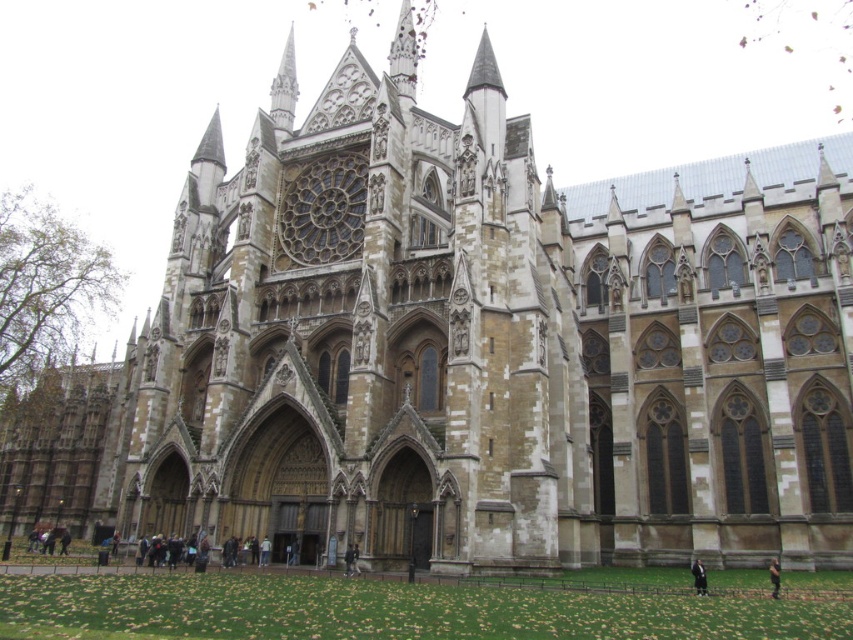
Question: Can you confirm if dark gray wool coat at lower right is positioned to the left of dark brown leather jacket at lower right?

Choices:
 (A) no
 (B) yes

Answer: (B)

Question: Can you confirm if dark gray wool coat at lower right is positioned above dark brown leather jacket at lower right?

Choices:
 (A) yes
 (B) no

Answer: (B)

Question: Which point appears farthest from the camera in this image?

Choices:
 (A) (779, 568)
 (B) (701, 584)

Answer: (A)

Question: Considering the relative positions of dark gray wool coat at lower right and dark brown leather jacket at lower right in the image provided, where is dark gray wool coat at lower right located with respect to dark brown leather jacket at lower right?

Choices:
 (A) left
 (B) right

Answer: (A)